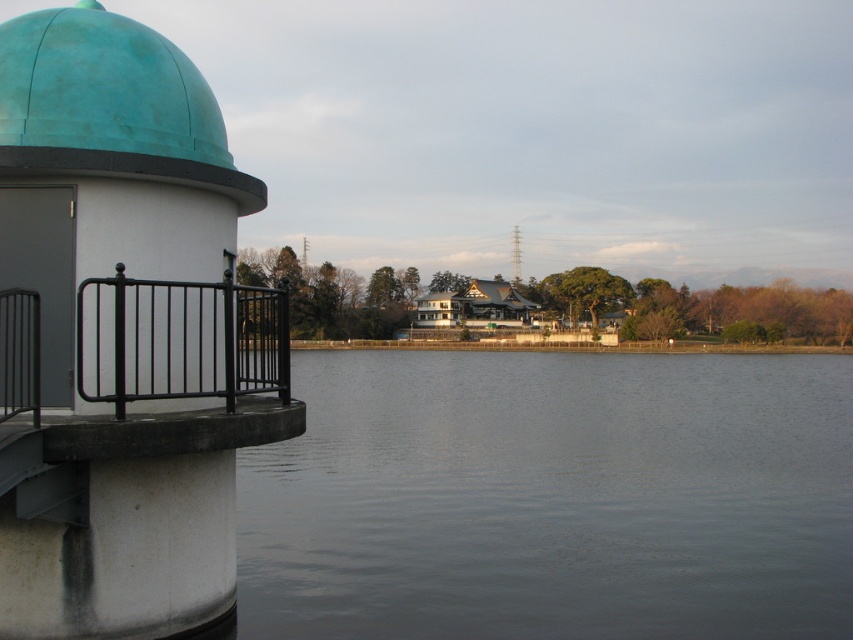
Who is shorter, dark gray water at center or matte white pillar at left?

dark gray water at center is shorter.

In the scene shown: Can you confirm if dark gray water at center is positioned to the left of matte white pillar at left?

Incorrect, dark gray water at center is not on the left side of matte white pillar at left.

Which is behind, point (700, 568) or point (74, 432)?

Positioned behind is point (700, 568).

You are a GUI agent. You are given a task and a screenshot of the screen. Output one action in this format:
    pyautogui.click(x=<x>, y=<y>)
    Task: Click on the dark gray water at center
    Image resolution: width=853 pixels, height=640 pixels.
    Given the screenshot: What is the action you would take?
    pyautogui.click(x=553, y=497)

Does dark gray water at center appear on the left side of metallic gray tower at center?

Yes, dark gray water at center is to the left of metallic gray tower at center.

Is dark gray water at center thinner than metallic gray tower at center?

In fact, dark gray water at center might be wider than metallic gray tower at center.

Is point (380, 524) behind point (520, 257)?

That is False.

Image resolution: width=853 pixels, height=640 pixels. I want to click on dark gray water at center, so click(553, 497).

Which is more to the right, matte white pillar at left or black wrought iron railing at left?

black wrought iron railing at left

The image size is (853, 640). In order to click on matte white pillar at left in this screenshot , I will do `click(125, 333)`.

Describe the element at coordinates (125, 333) in the screenshot. I see `matte white pillar at left` at that location.

The width and height of the screenshot is (853, 640). What are the coordinates of `matte white pillar at left` in the screenshot? It's located at click(x=125, y=333).